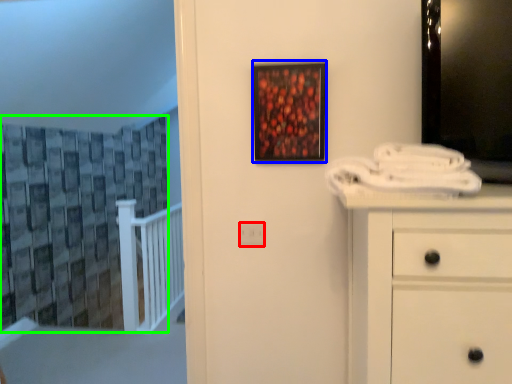
Question: Considering the real-world distances, which object is farthest from electric outlet (highlighted by a red box)? picture frame (highlighted by a blue box) or curtain (highlighted by a green box)?

Choices:
 (A) picture frame
 (B) curtain

Answer: (B)